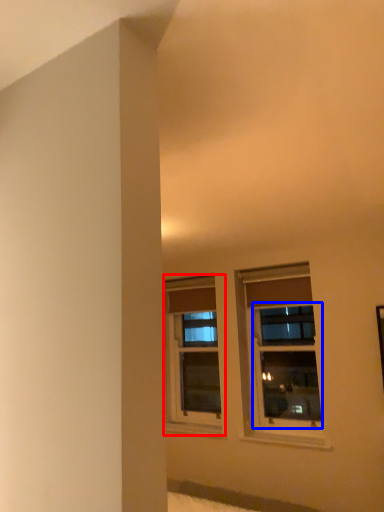
Question: Which of the following is the farthest to the observer, window (highlighted by a red box) or window (highlighted by a blue box)?

Choices:
 (A) window
 (B) window

Answer: (A)